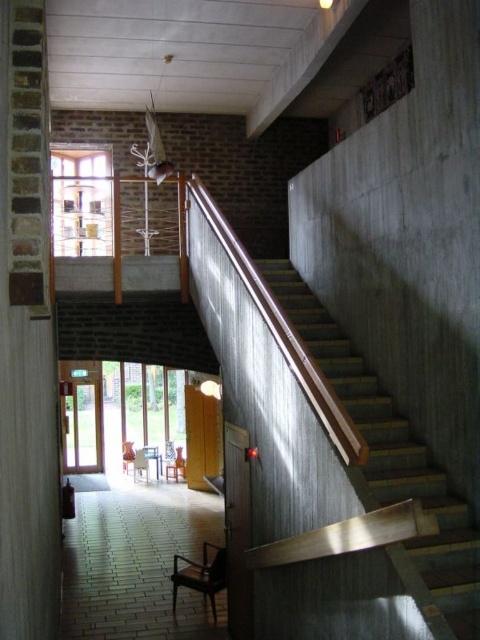
You are standing at the bottom of the staircase in the modern building. You want to know where the brick at left is located. Can you describe its position relative to the staircase?

The brick at left is located at the left side of the staircase, positioned at coordinates approximately 0.527 on the x axis and 0.054 on the y axis.

You are standing at the base of the staircase and want to hang a picture frame on the wall. The frame is 1.2 meters tall. Which object, the brick at left or the wooden stairs at right, can accommodate the height of the frame?

The brick at left is taller than the wooden stairs at right, so the brick at left can accommodate the 1.2 meters tall picture frame.

You are standing at the bottom of the staircase in the modern building. You see two points marked on the wall. The first point is at coordinates point (12, 284) and the second is at point (445, 544). If you were to walk straight up the staircase, which point would you encounter first?

Point (12, 284) is in front of point (445, 544), so you would encounter the point (12, 284) first as you walk up the staircase.